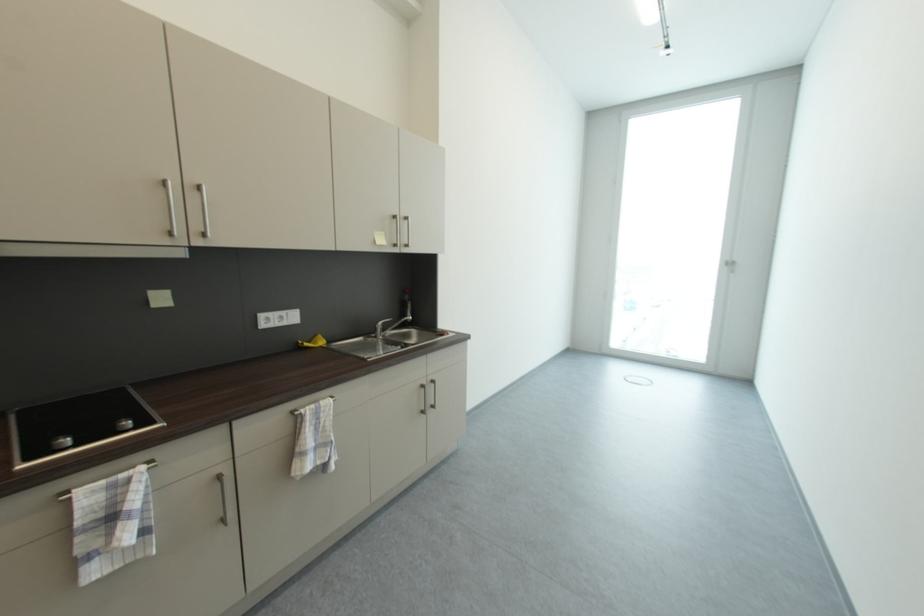
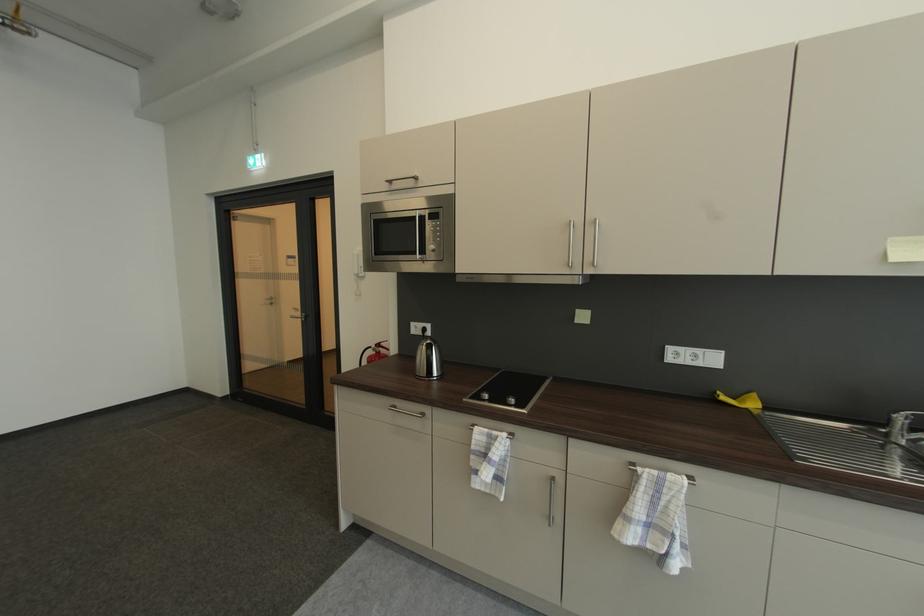
Question: The first image is from the beginning of the video and the second image is from the end. How did the camera likely rotate when shooting the video?

Choices:
 (A) Left
 (B) Right
 (C) Up
 (D) Down

Answer: (A)